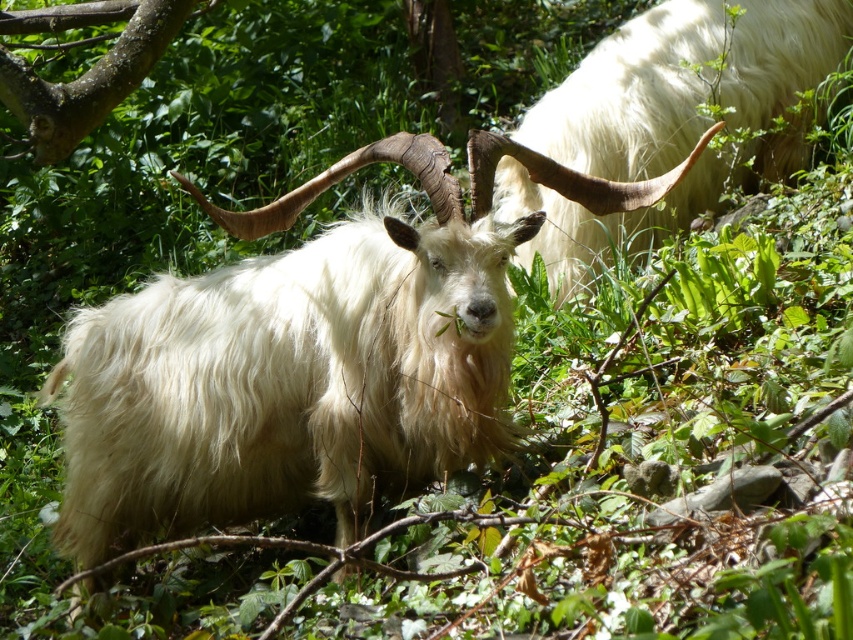
You are a hiker who wants to take a photo of the white woolen goat at center and the brown rough bark at upper left. Which object should you focus on first if you want to capture both in one frame without moving the camera?

The white woolen goat at center is located below the brown rough bark at upper left, so you should focus on the brown rough bark at upper left first since it is farther away and adjust the focus accordingly to include both in the frame.

You are a hiker who wants to take a photo of the white woolly goat at upper right and the brown rough bark at upper left. Which object should you focus on first if you want to capture both in the same frame without moving the camera?

You should focus on the brown rough bark at upper left first because the white woolly goat at upper right is located below it, so adjusting the focus to the closer object first would allow both to be in the frame.